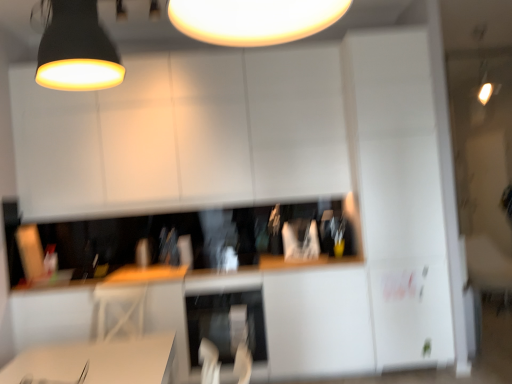
Question: From the image's perspective, would you say satin silver dishwasher at center is positioned over white glossy computer desk at lower center?

Choices:
 (A) yes
 (B) no

Answer: (B)

Question: Considering the relative positions of satin silver dishwasher at center and white glossy computer desk at lower center in the image provided, is satin silver dishwasher at center to the right of white glossy computer desk at lower center from the viewer's perspective?

Choices:
 (A) yes
 (B) no

Answer: (A)

Question: Is satin silver dishwasher at center thinner than white glossy computer desk at lower center?

Choices:
 (A) yes
 (B) no

Answer: (B)

Question: Can you see satin silver dishwasher at center touching white glossy computer desk at lower center?

Choices:
 (A) no
 (B) yes

Answer: (A)

Question: Is satin silver dishwasher at center behind white glossy computer desk at lower center?

Choices:
 (A) no
 (B) yes

Answer: (B)

Question: Does satin silver dishwasher at center have a smaller size compared to white glossy computer desk at lower center?

Choices:
 (A) no
 (B) yes

Answer: (A)

Question: From the image's perspective, is white glossy computer desk at lower center located beneath matte black lampshade at upper left, the 1th lamp positioned from the left?

Choices:
 (A) no
 (B) yes

Answer: (B)

Question: Considering the relative positions of white glossy computer desk at lower center and matte black lampshade at upper left, marked as the second lamp in a back-to-front arrangement, in the image provided, is white glossy computer desk at lower center to the right of matte black lampshade at upper left, marked as the second lamp in a back-to-front arrangement, from the viewer's perspective?

Choices:
 (A) no
 (B) yes

Answer: (A)

Question: Is white glossy computer desk at lower center closer to camera compared to matte black lampshade at upper left, which is the 1th lamp in bottom-to-top order?

Choices:
 (A) no
 (B) yes

Answer: (A)

Question: Would you say white glossy computer desk at lower center contains matte black lampshade at upper left, marked as the second lamp in a back-to-front arrangement?

Choices:
 (A) no
 (B) yes

Answer: (A)

Question: Is white glossy computer desk at lower center further to the viewer compared to matte black lampshade at upper left, which is counted as the 1th lamp, starting from the front?

Choices:
 (A) yes
 (B) no

Answer: (A)

Question: From the image's perspective, is white glossy computer desk at lower center above matte black lampshade at upper left, marked as the second lamp in a back-to-front arrangement?

Choices:
 (A) yes
 (B) no

Answer: (B)

Question: Is matte black lampshade at upper left, which is counted as the 1th lamp, starting from the front, surrounding satin silver dishwasher at center?

Choices:
 (A) yes
 (B) no

Answer: (B)